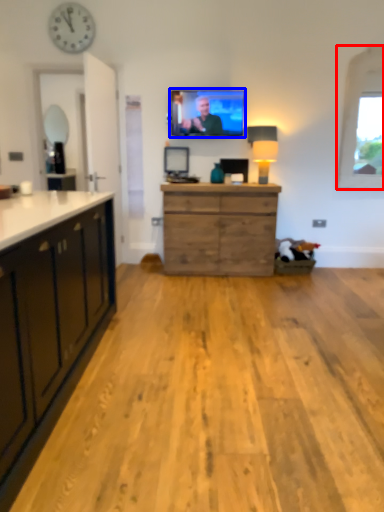
Question: Which point is further to the camera, window (highlighted by a red box) or television (highlighted by a blue box)?

Choices:
 (A) window
 (B) television

Answer: (B)